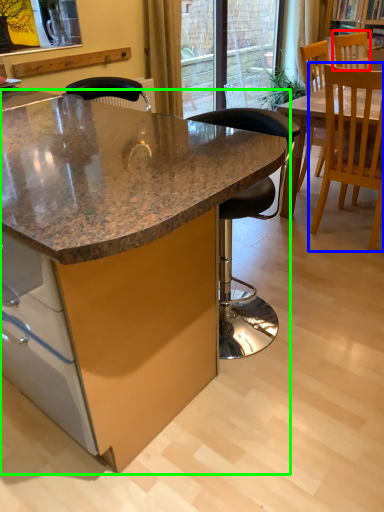
Question: Estimate the real-world distances between objects in this image. Which object is farther from chair (highlighted by a red box), chair (highlighted by a blue box) or table (highlighted by a green box)?

Choices:
 (A) chair
 (B) table

Answer: (B)